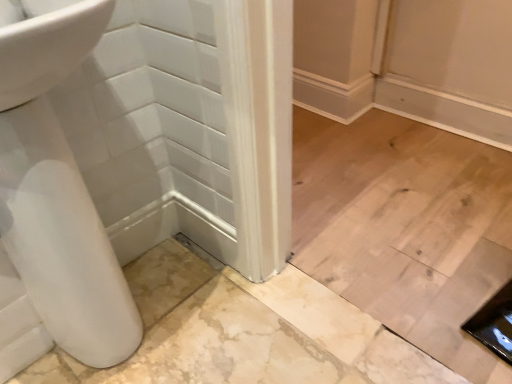
Describe the element at coordinates (58, 193) in the screenshot. The image size is (512, 384). I see `white glossy sink at lower left` at that location.

The image size is (512, 384). What are the coordinates of `white glossy sink at lower left` in the screenshot? It's located at (58, 193).

Measure the distance between point (12, 175) and camera.

A distance of 28.35 inches exists between point (12, 175) and camera.

Where is `white glossy sink at lower left`? The width and height of the screenshot is (512, 384). white glossy sink at lower left is located at coordinates (58, 193).